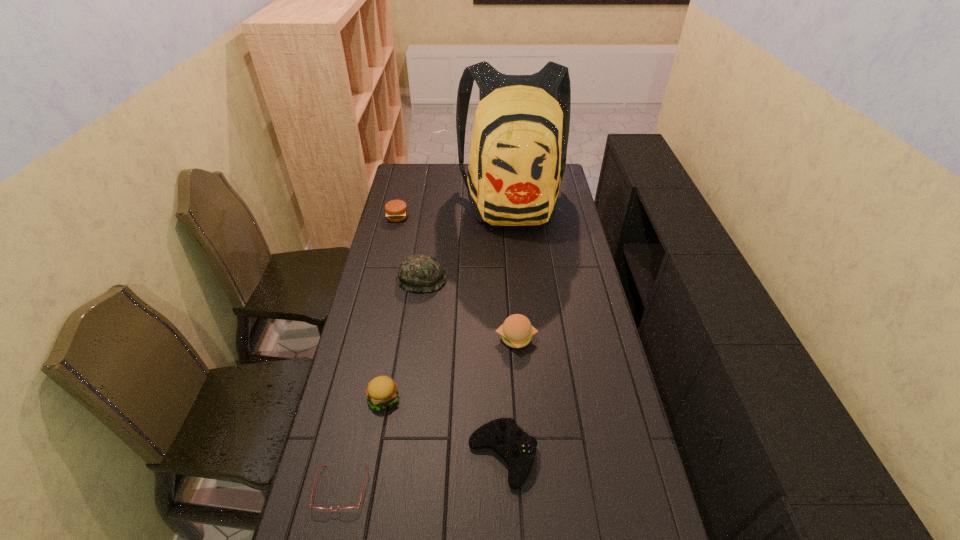
Find the location of a particular element. vacant region at the left edge of the desktop is located at coordinates 401,301.

Where is `vacant space at the right edge of the desktop`? The image size is (960, 540). vacant space at the right edge of the desktop is located at coordinates (555, 210).

Find the location of a particular element. The width and height of the screenshot is (960, 540). free point between the spectacles and the nearest hamburger is located at coordinates (362, 443).

The height and width of the screenshot is (540, 960). Find the location of `vacant space in between the tallest object and the headwear`. vacant space in between the tallest object and the headwear is located at coordinates (467, 241).

Find the location of a particular element. vacant point located between the rightmost hamburger and the shortest object is located at coordinates point(428,413).

The image size is (960, 540). I want to click on unoccupied area between the headwear and the fourth nearest object, so click(468, 308).

Locate an element on the screen. The width and height of the screenshot is (960, 540). free space between the tallest hamburger and the farthest hamburger is located at coordinates (457, 278).

Locate an element on the screen. Image resolution: width=960 pixels, height=540 pixels. empty space that is in between the control and the farthest hamburger is located at coordinates (450, 336).

Find the location of a particular element. vacant region between the control and the farthest hamburger is located at coordinates (450, 336).

The image size is (960, 540). I want to click on free space that is in between the control and the shortest object, so click(x=421, y=472).